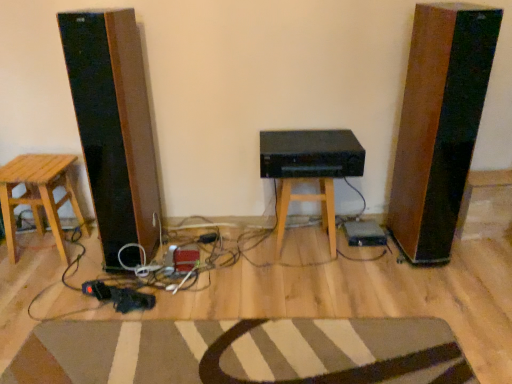
The width and height of the screenshot is (512, 384). Find the location of `vacant area that lies to the right of wooden stool at left, acting as the second stool starting from the right`. vacant area that lies to the right of wooden stool at left, acting as the second stool starting from the right is located at coordinates (89, 255).